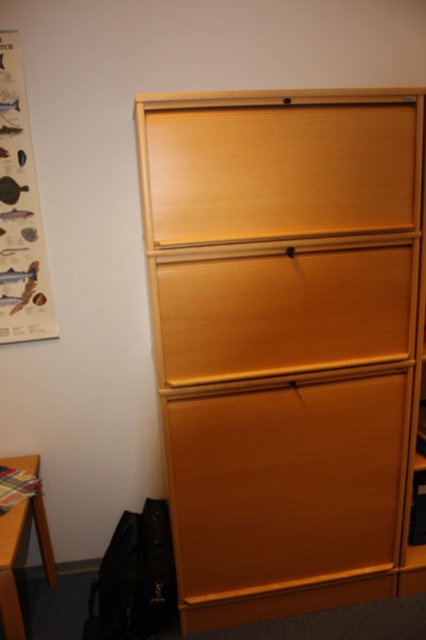
Question: Can you confirm if matte wood drawer at upper center is positioned below wooden table at lower left?

Choices:
 (A) yes
 (B) no

Answer: (B)

Question: Which is nearer to the wooden drawer at center?

Choices:
 (A) wooden drawer at lower center
 (B) matte wood drawer at upper center

Answer: (B)

Question: Is matte wood drawer at upper center bigger than wooden drawer at center?

Choices:
 (A) no
 (B) yes

Answer: (A)

Question: Estimate the real-world distances between objects in this image. Which object is closer to the wooden table at lower left?

Choices:
 (A) light wood dresser at center
 (B) matte wood drawer at upper center

Answer: (A)

Question: Does light wood dresser at center have a smaller size compared to wooden drawer at center?

Choices:
 (A) no
 (B) yes

Answer: (A)

Question: Which object is positioned closest to the wooden drawer at center?

Choices:
 (A) light wood dresser at center
 (B) matte wood drawer at upper center

Answer: (A)